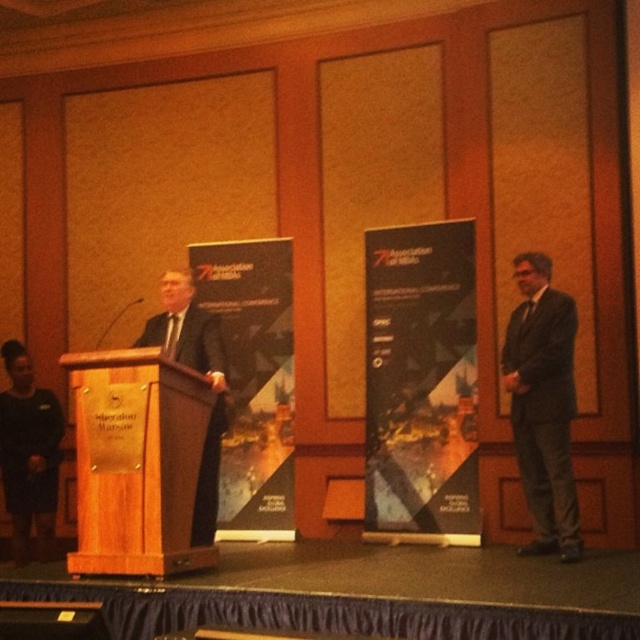
You are standing in the audience looking at the stage. There is a point at coordinates (541, 404) on the stage. What object is located at that point?

The point at coordinates (541, 404) corresponds to the dark gray suit at right.

You are attending a formal event and notice two attendees wearing dark gray suit at right and black suit at left. Which attendee is closer to the front of the stage?

The dark gray suit at right is smaller than the black suit at left, so the dark gray suit at right is closer to the front of the stage because objects that are closer appear smaller in the image.